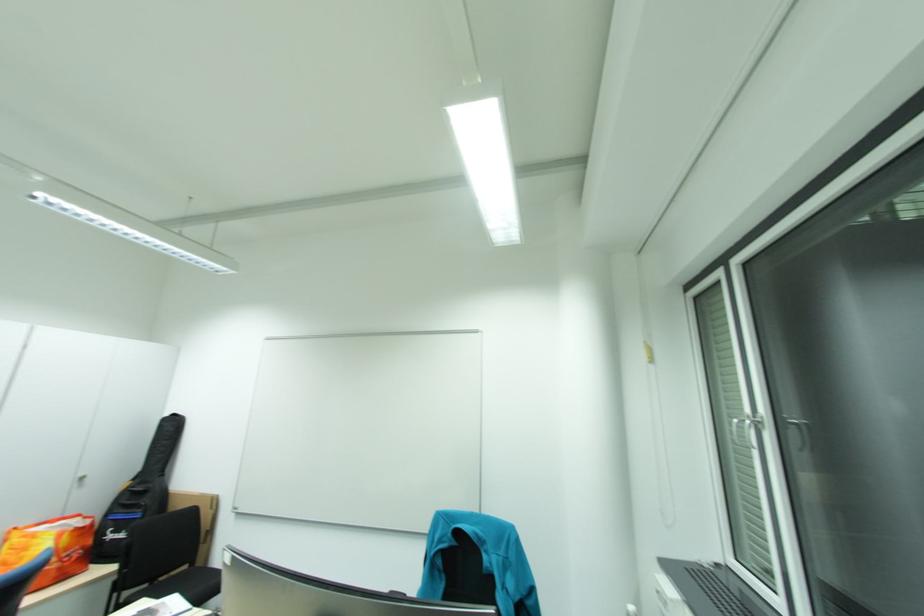
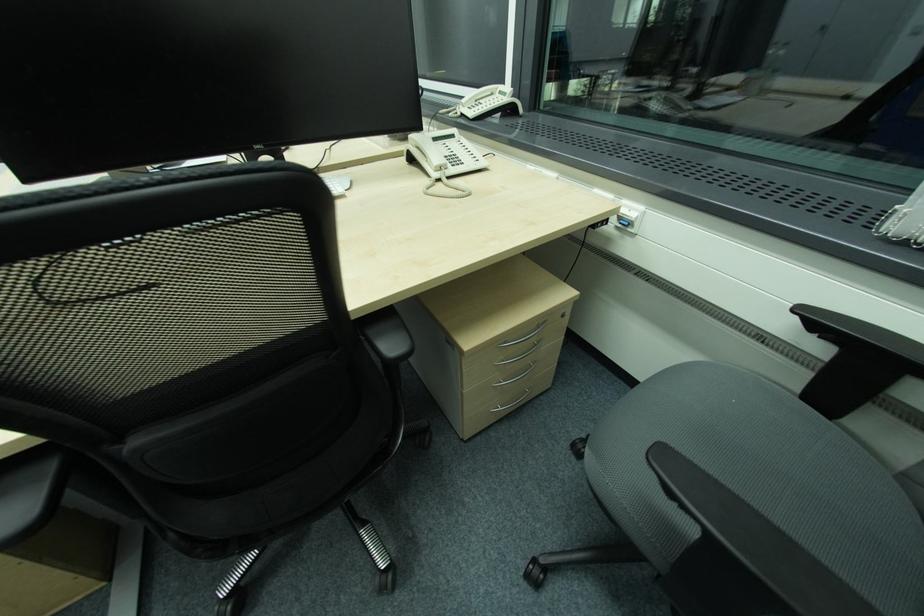
How did the camera likely rotate?

The camera's rotation is toward right-down.